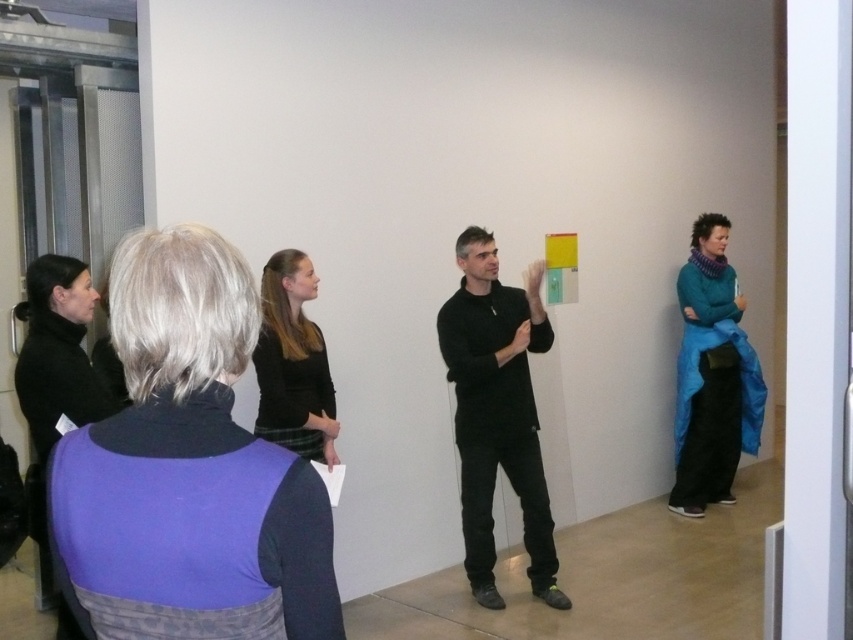
Question: Does purple fabric vest at lower left lie in front of black matte jacket at lower left?

Choices:
 (A) no
 (B) yes

Answer: (B)

Question: Which is nearer to the black matte dress at center?

Choices:
 (A) black matte shirt at center
 (B) blue fabric coat at right
 (C) purple fabric vest at lower left

Answer: (A)

Question: Which point is farther to the camera?

Choices:
 (A) (258, 625)
 (B) (33, 465)
 (C) (486, 504)
 (D) (265, 426)

Answer: (C)

Question: Among these points, which one is nearest to the camera?

Choices:
 (A) (252, 516)
 (B) (733, 312)
 (C) (70, 259)
 (D) (479, 458)

Answer: (A)

Question: Is purple fabric vest at lower left positioned at the back of blue fabric coat at right?

Choices:
 (A) yes
 (B) no

Answer: (B)

Question: Does purple fabric vest at lower left lie in front of black matte dress at center?

Choices:
 (A) yes
 (B) no

Answer: (A)